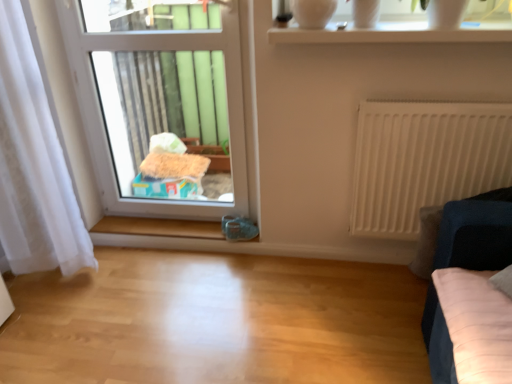
You are a GUI agent. You are given a task and a screenshot of the screen. Output one action in this format:
    pyautogui.click(x=<x>, y=<y>)
    Task: Click on the transparent plastic window at center, the 1th window from the back
    Image resolution: width=512 pixels, height=384 pixels.
    Given the screenshot: What is the action you would take?
    pyautogui.click(x=157, y=94)

The image size is (512, 384). What do you see at coordinates (365, 13) in the screenshot?
I see `transparent glass vase at upper center` at bounding box center [365, 13].

In order to click on white matte radiator at right in this screenshot , I will do `click(424, 160)`.

Locate an element on the screen. The image size is (512, 384). transparent plastic window at center, arranged as the 2th window when viewed from the right is located at coordinates (157, 94).

Would you say white matte radiator at right is to the left or to the right of velvet dark blue sofa at right in the picture?

Clearly, white matte radiator at right is on the left of velvet dark blue sofa at right in the image.

In terms of height, does white matte radiator at right look taller or shorter compared to velvet dark blue sofa at right?

In the image, white matte radiator at right appears to be taller than velvet dark blue sofa at right.

Is velvet dark blue sofa at right completely or partially inside white matte radiator at right?

No, white matte radiator at right does not contain velvet dark blue sofa at right.

Is velvet dark blue sofa at right at the back of white matte radiator at right?

That's right, white matte radiator at right is facing away from velvet dark blue sofa at right.

Can you tell me how much transparent glass vase at upper center and white glossy vase at upper center, marked as the 2th window in a left-to-right arrangement, differ in facing direction?

The angular difference between transparent glass vase at upper center and white glossy vase at upper center, marked as the 2th window in a left-to-right arrangement, is 2.65 degrees.

Is transparent glass vase at upper center far from white glossy vase at upper center, which ranks as the first window in front-to-back order?

No, there isn't a large distance between transparent glass vase at upper center and white glossy vase at upper center, which ranks as the first window in front-to-back order.

Which of these two, transparent glass vase at upper center or white glossy vase at upper center, marked as the 2th window in a left-to-right arrangement, stands taller?

transparent glass vase at upper center is taller.

Is transparent glass vase at upper center wider than white glossy vase at upper center, marked as the 2th window in a left-to-right arrangement?

Result: In fact, transparent glass vase at upper center might be narrower than white glossy vase at upper center, marked as the 2th window in a left-to-right arrangement.

Is velvet dark blue sofa at right in contact with white sheer curtain at left?

There is a gap between velvet dark blue sofa at right and white sheer curtain at left.

From a real-world perspective, which is physically below, velvet dark blue sofa at right or white sheer curtain at left?

velvet dark blue sofa at right.

Measure the distance between velvet dark blue sofa at right and white sheer curtain at left.

velvet dark blue sofa at right and white sheer curtain at left are 5.21 feet apart.

Does transparent plastic window at center, the 2th window positioned from the front, touch white matte radiator at right?

They are not placed beside each other.

From a real-world perspective, which object rests below the other?

From a 3D spatial view, white matte radiator at right is below.

Between point (226, 67) and point (508, 110), which one is positioned in front?

Point (508, 110)

From the picture: Is white glossy vase at upper center, the second window when ordered from back to front, taller or shorter than transparent glass vase at upper center?

Considering their sizes, white glossy vase at upper center, the second window when ordered from back to front, has less height than transparent glass vase at upper center.

Is white glossy vase at upper center, marked as the 2th window in a left-to-right arrangement, oriented towards transparent glass vase at upper center?

No, white glossy vase at upper center, marked as the 2th window in a left-to-right arrangement, does not turn towards transparent glass vase at upper center.

I want to click on the 1st window below the transparent glass vase at upper center (from the image's perspective), so click(x=409, y=24).

You are a GUI agent. You are given a task and a screenshot of the screen. Output one action in this format:
    pyautogui.click(x=<x>, y=<y>)
    Task: Click on the furniture below the transparent glass vase at upper center (from the image's perspective)
    Image resolution: width=512 pixels, height=384 pixels.
    Given the screenshot: What is the action you would take?
    pyautogui.click(x=476, y=232)

Can you confirm if velvet dark blue sofa at right is bigger than transparent glass vase at upper center?

Yes.

Is velvet dark blue sofa at right positioned before transparent glass vase at upper center?

Yes.

Is white glossy vase at upper center, which is the first window from right to left, located within white sheer curtain at left?

Definitely not — white glossy vase at upper center, which is the first window from right to left, is not inside white sheer curtain at left.

Does white sheer curtain at left have a smaller size compared to white glossy vase at upper center, which is the first window from right to left?

No.

Is white sheer curtain at left turned away from white glossy vase at upper center, which is the first window from right to left?

No, white glossy vase at upper center, which is the first window from right to left, is not at the back of white sheer curtain at left.

From the picture: From a real-world perspective, is white sheer curtain at left on white glossy vase at upper center, the second window when ordered from back to front?

Actually, white sheer curtain at left is physically below white glossy vase at upper center, the second window when ordered from back to front, in the real world.

Image resolution: width=512 pixels, height=384 pixels. I want to click on furniture on the right of white matte radiator at right, so click(x=476, y=232).

I want to click on glass vase behind the white glossy vase at upper center, which is the first window from right to left, so click(365, 13).

From the image, which object appears to be farther from white sheer curtain at left, white glossy vase at upper center, the second window when ordered from back to front, or velvet dark blue sofa at right?

velvet dark blue sofa at right is further to white sheer curtain at left.

Considering their positions, is white glossy vase at upper center, the second window when ordered from back to front, positioned closer to transparent glass vase at upper center than white sheer curtain at left?

white glossy vase at upper center, the second window when ordered from back to front, is closer to transparent glass vase at upper center.

Based on their spatial positions, is white sheer curtain at left or transparent glass vase at upper center further from white glossy vase at upper center, the second window when ordered from back to front?

Among the two, white sheer curtain at left is located further to white glossy vase at upper center, the second window when ordered from back to front.

Estimate the real-world distances between objects in this image. Which object is closer to velvet dark blue sofa at right, transparent glass vase at upper center or white matte radiator at right?

white matte radiator at right lies closer to velvet dark blue sofa at right than the other object.

Estimate the real-world distances between objects in this image. Which object is further from transparent glass vase at upper center, velvet dark blue sofa at right or white sheer curtain at left?

Based on the image, white sheer curtain at left appears to be further to transparent glass vase at upper center.

Which object lies further to the anchor point transparent plastic window at center, marked as the 1th window in a left-to-right arrangement, white sheer curtain at left or white matte radiator at right?

white matte radiator at right.

Based on their spatial positions, is white glossy vase at upper center, the second window when ordered from back to front, or transparent plastic window at center, the 2th window positioned from the front, closer to transparent glass vase at upper center?

The object closer to transparent glass vase at upper center is white glossy vase at upper center, the second window when ordered from back to front.

Estimate the real-world distances between objects in this image. Which object is further from transparent glass vase at upper center, transparent plastic window at center, the 2th window positioned from the front, or white matte radiator at right?

transparent plastic window at center, the 2th window positioned from the front, is further to transparent glass vase at upper center.

At what (x,y) coordinates should I click in order to perform the action: click on window situated between transparent plastic window at center, arranged as the 2th window when viewed from the right, and white matte radiator at right from left to right. Please return your answer as a coordinate pair (x, y). Image resolution: width=512 pixels, height=384 pixels. Looking at the image, I should click on (409, 24).

Where is `window between white sheer curtain at left and white glossy vase at upper center, marked as the 2th window in a left-to-right arrangement, from left to right`? This screenshot has height=384, width=512. window between white sheer curtain at left and white glossy vase at upper center, marked as the 2th window in a left-to-right arrangement, from left to right is located at coordinates (157, 94).

Identify the location of radiator that lies between transparent glass vase at upper center and velvet dark blue sofa at right from top to bottom. This screenshot has width=512, height=384. (424, 160).

You are a GUI agent. You are given a task and a screenshot of the screen. Output one action in this format:
    pyautogui.click(x=<x>, y=<y>)
    Task: Click on the radiator between white sheer curtain at left and velvet dark blue sofa at right from left to right
    The image size is (512, 384).
    Given the screenshot: What is the action you would take?
    pyautogui.click(x=424, y=160)